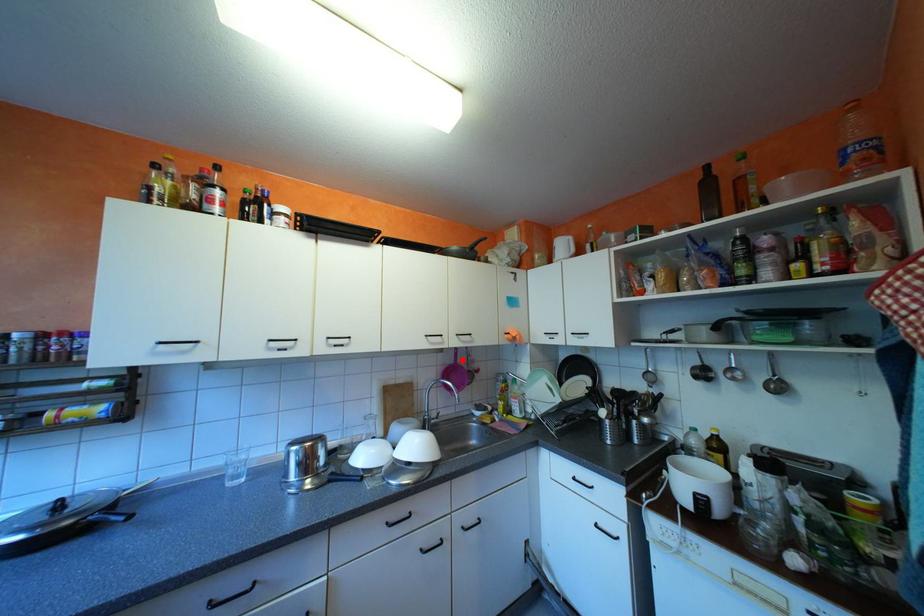
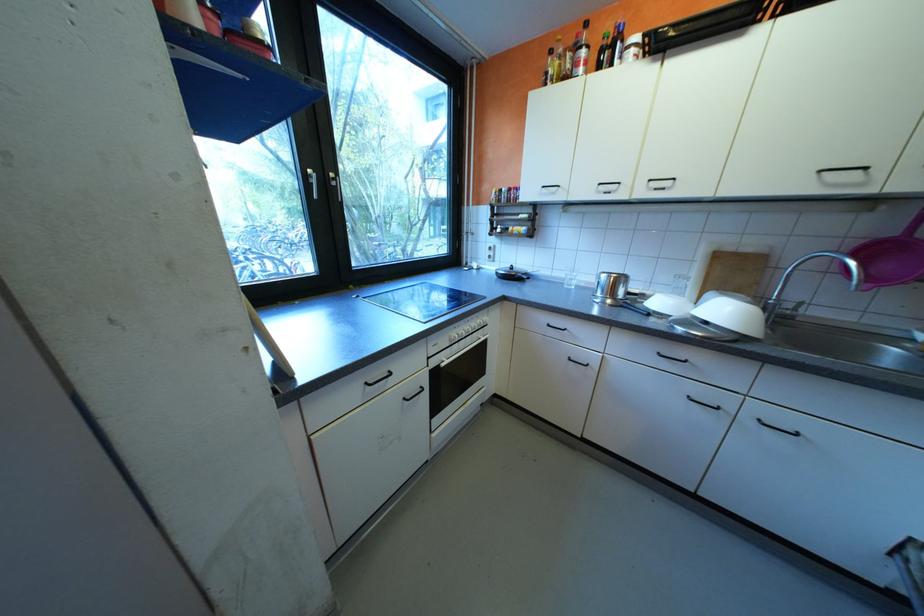
Locate, in the second image, the point that corresponds to the highlighted location in the first image.

(906, 231)